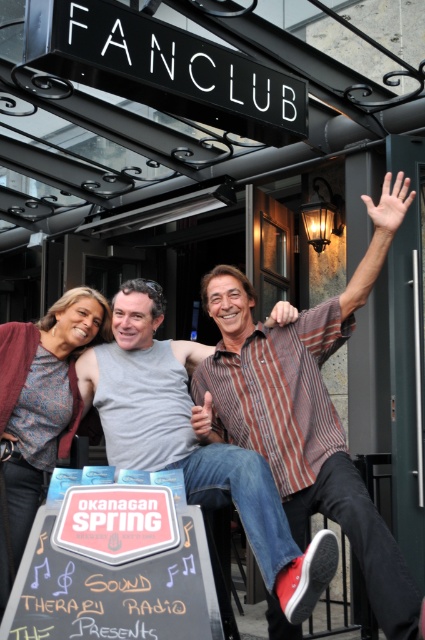
You are a fashion designer observing the striped cotton shirt at center and the matte gray sweater at center in the image. Which clothing item appears shorter in height?

The striped cotton shirt at center has a lesser height compared to the matte gray sweater at center, so the striped cotton shirt at center appears shorter in height.

You are a photographer taking a picture of two people wearing striped cotton shirts. The striped cotton shirt at upper right and the striped cotton shirt at center are both in your frame. Which striped cotton shirt is closer to you?

The striped cotton shirt at upper right is closer to the viewer than the striped cotton shirt at center.